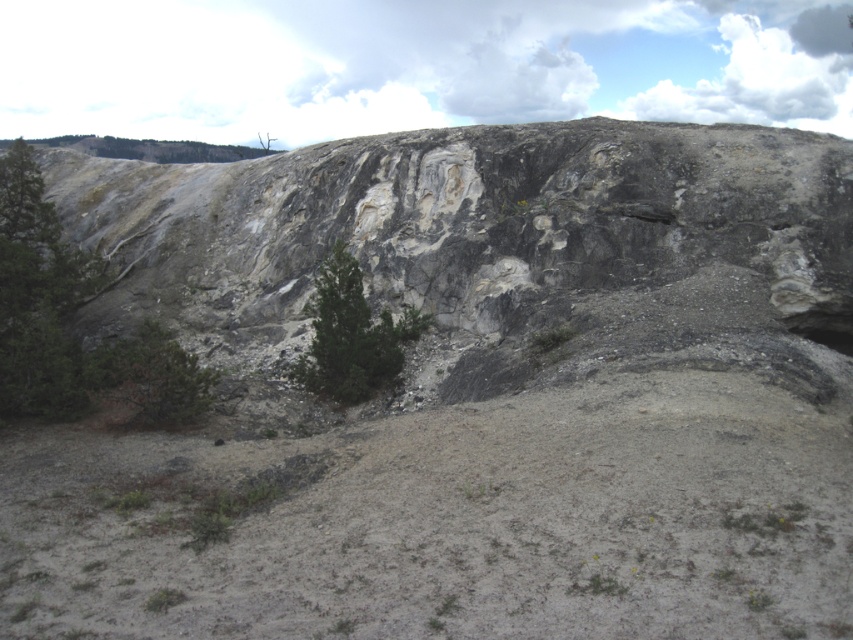
Question: Is green matte tree at left positioned in front of green matte tree at center?

Choices:
 (A) no
 (B) yes

Answer: (B)

Question: Among these objects, which one is nearest to the camera?

Choices:
 (A) green matte tree at left
 (B) green matte tree at center

Answer: (A)

Question: Which point is farther to the camera?

Choices:
 (A) green matte tree at left
 (B) green matte tree at center

Answer: (B)

Question: Is green matte tree at left wider than green matte tree at center?

Choices:
 (A) no
 (B) yes

Answer: (B)

Question: Can you confirm if green matte tree at left is bigger than green matte tree at center?

Choices:
 (A) yes
 (B) no

Answer: (A)